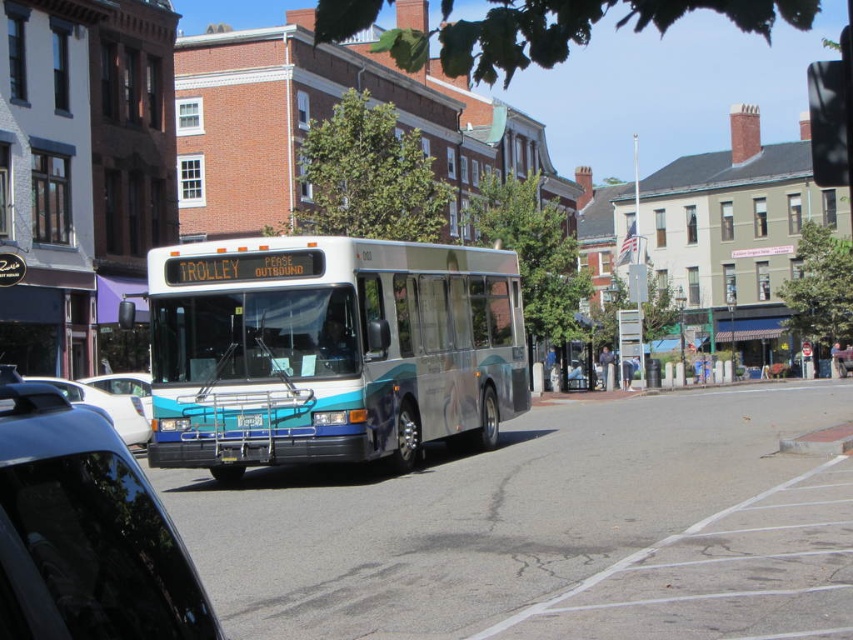
You are a delivery driver who needs to park your truck next to the black glossy car at left and the blue metallic license plate at center. Since your truck is 2 meters tall, will there be enough vertical space for it between the two objects?

The black glossy car at left is much taller than the blue metallic license plate at center. Since the truck is 2 meters tall, it should fit between them as long as the shorter object, the blue metallic license plate at center, provides sufficient clearance. However, without exact measurements, we can only assume based on relative sizes.

You are a pedestrian standing at the crosswalk near the trolley bus. You want to cross the street to reach the buildings in the background. Which vehicle should you avoid first, the black glossy car at left or the white glossy sedan at lower left, based on their positions?

The black glossy car at left is located above the white glossy sedan at lower left, so you should avoid the black glossy car at left first as it is positioned higher up and closer to your path.